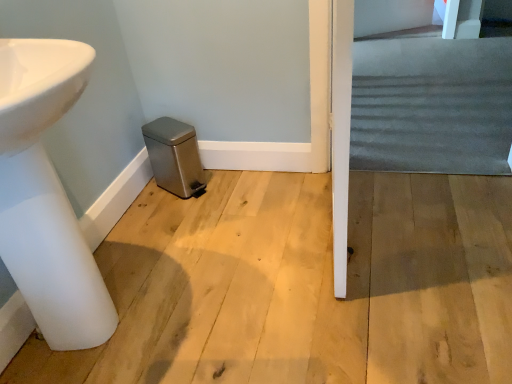
Where is `vacant region to the right of white glossy sink at lower left`? The height and width of the screenshot is (384, 512). vacant region to the right of white glossy sink at lower left is located at coordinates (237, 302).